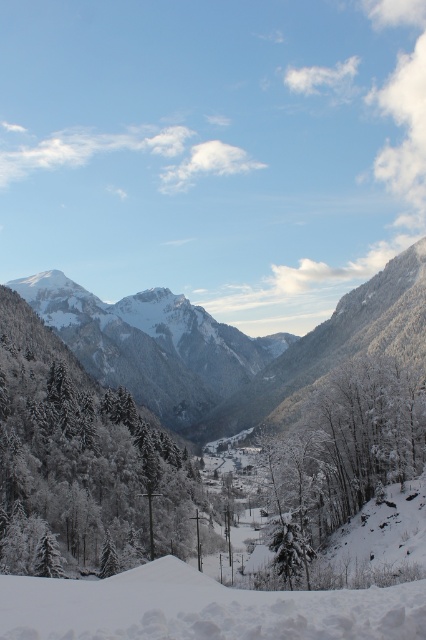
Is green matte tree at left above white snow ski slope at lower center?

Yes, green matte tree at left is above white snow ski slope at lower center.

Between green matte tree at left and white snow ski slope at lower center, which one has less height?

white snow ski slope at lower center is shorter.

The image size is (426, 640). What are the coordinates of `green matte tree at left` in the screenshot? It's located at (80, 458).

Does point (74, 513) lie behind point (342, 378)?

No.

Who is positioned more to the left, green matte tree at left or white frosty trees at center?

green matte tree at left is more to the left.

This screenshot has width=426, height=640. Find the location of `green matte tree at left`. green matte tree at left is located at coordinates (80, 458).

Is snowy granite mountain at center positioned in front of white snow ski slope at lower center?

No, it is behind white snow ski slope at lower center.

Identify the location of snowy granite mountain at center. This screenshot has height=640, width=426. (230, 346).